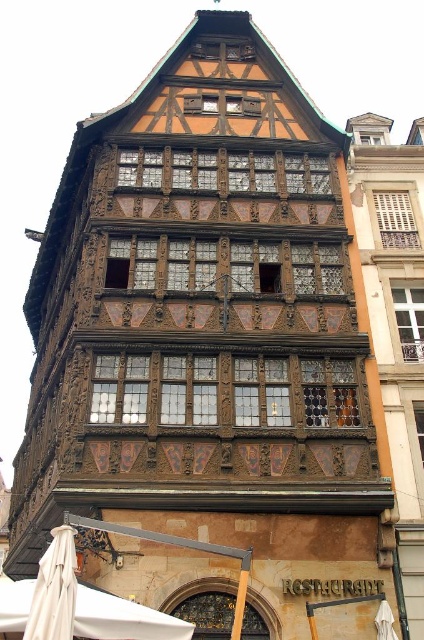
Question: Which point is closer to the camera?

Choices:
 (A) (164, 632)
 (B) (390, 608)

Answer: (A)

Question: Does beige fabric umbrella at lower left appear over white fabric umbrella at lower right?

Choices:
 (A) no
 (B) yes

Answer: (B)

Question: Estimate the real-world distances between objects in this image. Which object is farther from the white fabric canopy at lower left?

Choices:
 (A) beige fabric umbrella at lower left
 (B) white fabric umbrella at lower right

Answer: (B)

Question: Is white fabric canopy at lower left smaller than white fabric umbrella at lower right?

Choices:
 (A) yes
 (B) no

Answer: (B)

Question: Based on their relative distances, which object is farther from the beige fabric umbrella at lower left?

Choices:
 (A) white fabric canopy at lower left
 (B) white fabric umbrella at lower right

Answer: (B)

Question: Can you confirm if beige fabric umbrella at lower left is wider than white fabric umbrella at lower right?

Choices:
 (A) no
 (B) yes

Answer: (B)